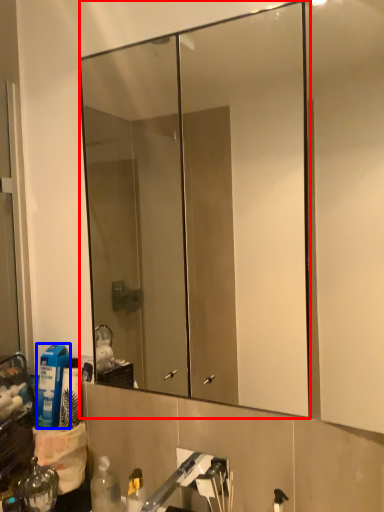
Question: Which object appears closest to the camera in this image, mirror (highlighted by a red box) or cleaning product (highlighted by a blue box)?

Choices:
 (A) mirror
 (B) cleaning product

Answer: (A)